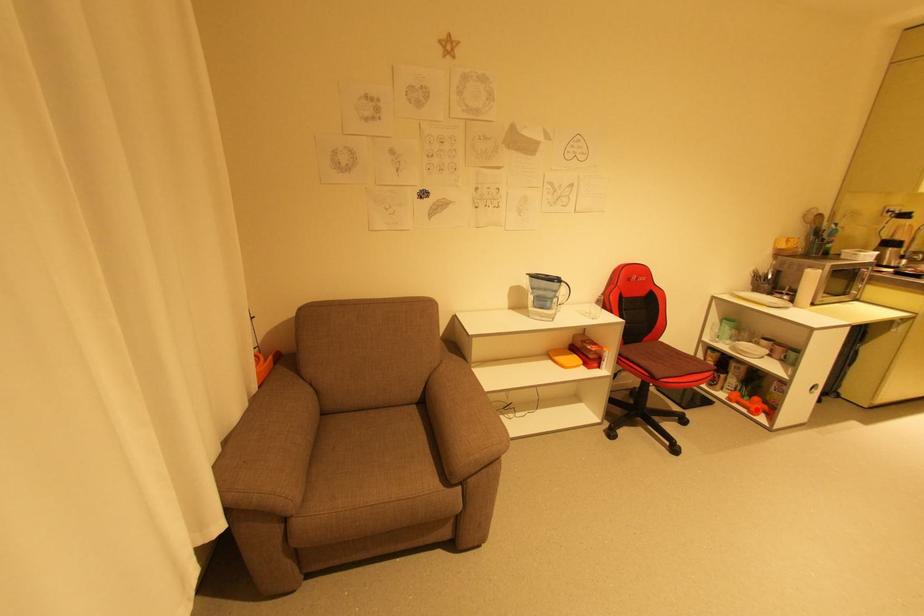
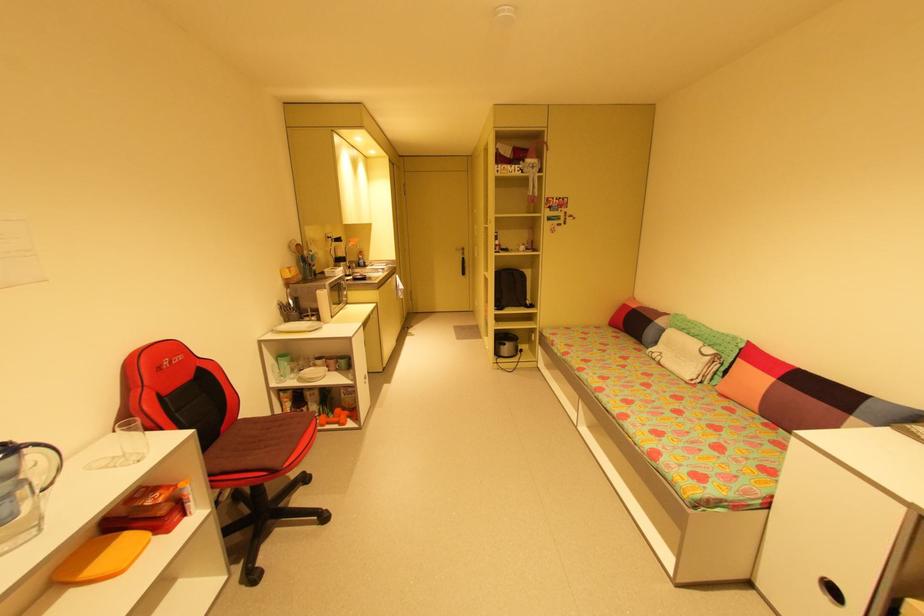
Question: I am providing you with two images of the same scene from different viewpoints. In image1, a red point is highlighted. Considering the same 3D point in image2, which of the following is correct?

Choices:
 (A) It is closer
 (B) It is farther

Answer: (A)